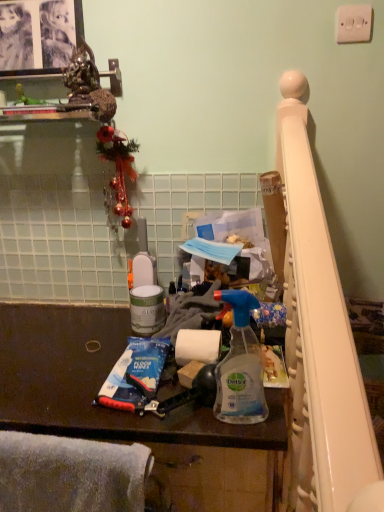
I want to click on empty space that is ontop of blue plastic toothpaste at lower center (from a real-world perspective), so click(x=133, y=379).